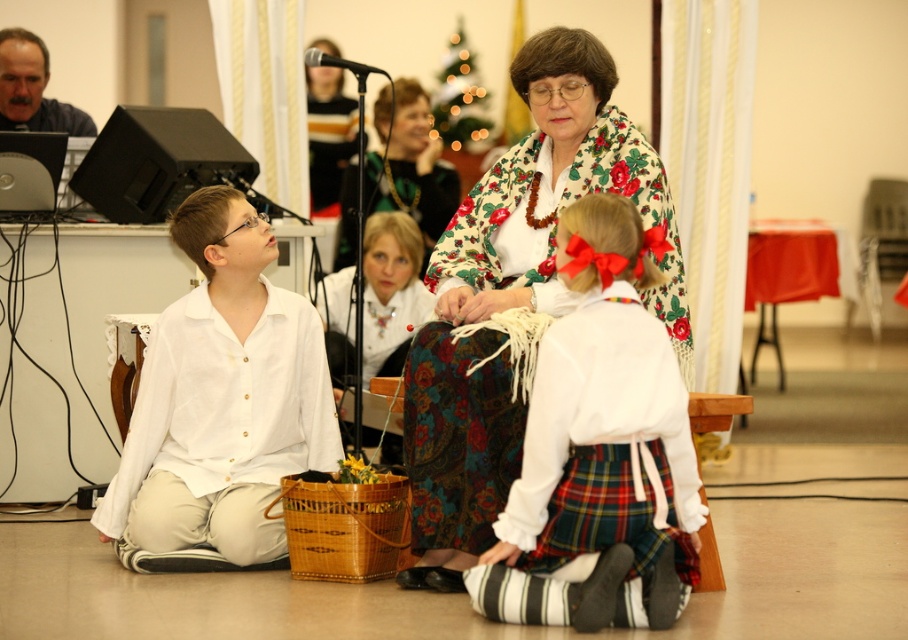
Question: Which point is farther to the camera?

Choices:
 (A) white linen shirt at left
 (B) white cotton blouse at center

Answer: (A)

Question: Which point appears closest to the camera in this image?

Choices:
 (A) (247, 364)
 (B) (601, 524)

Answer: (B)

Question: Is white cotton blouse at center to the left of white linen shirt at left from the viewer's perspective?

Choices:
 (A) no
 (B) yes

Answer: (A)

Question: Does white cotton blouse at center appear under white linen shirt at left?

Choices:
 (A) no
 (B) yes

Answer: (B)

Question: Does white cotton blouse at center come behind white linen shirt at left?

Choices:
 (A) yes
 (B) no

Answer: (B)

Question: Which point is farther to the camera?

Choices:
 (A) (201, 445)
 (B) (604, 280)

Answer: (A)